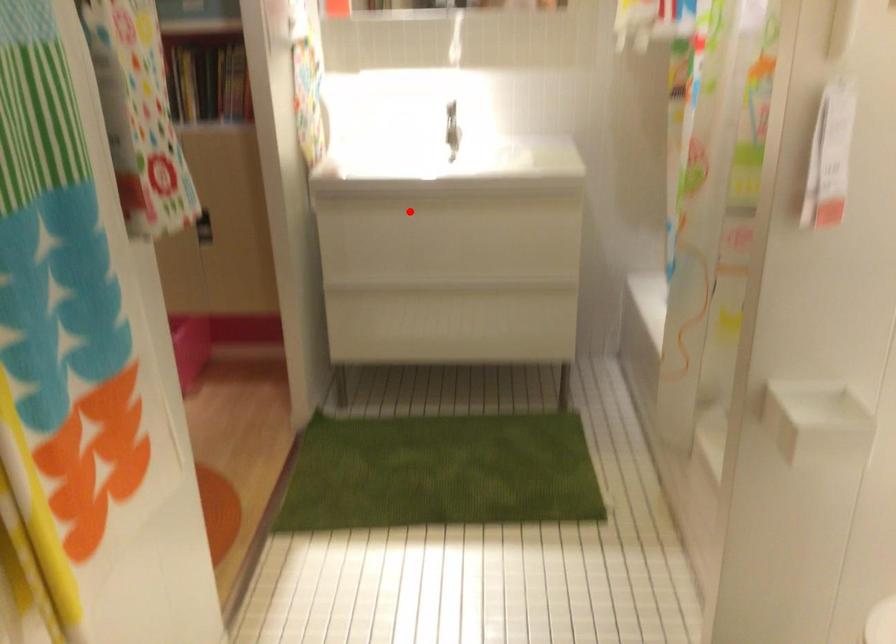
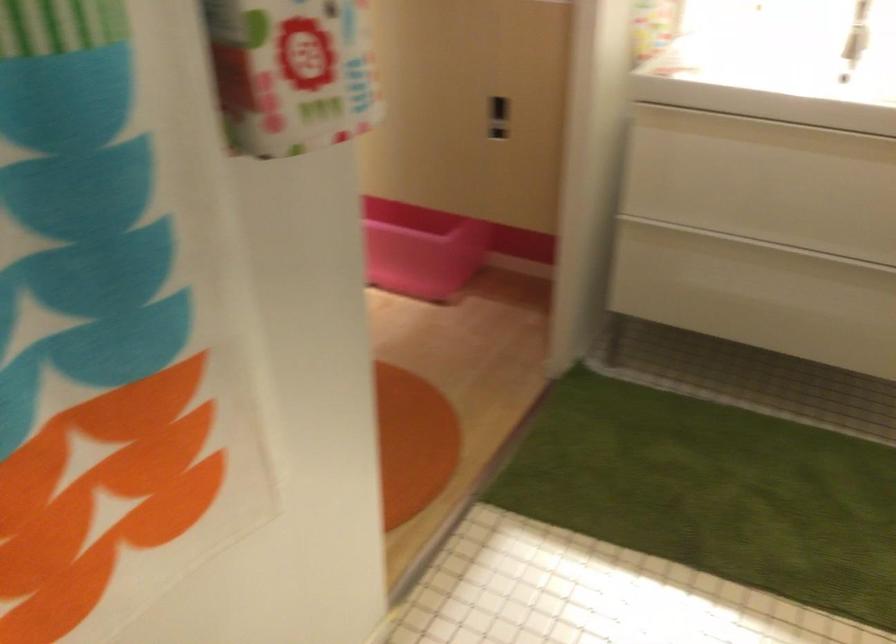
Find the pixel in the second image that matches the highlighted location in the first image.

(764, 131)